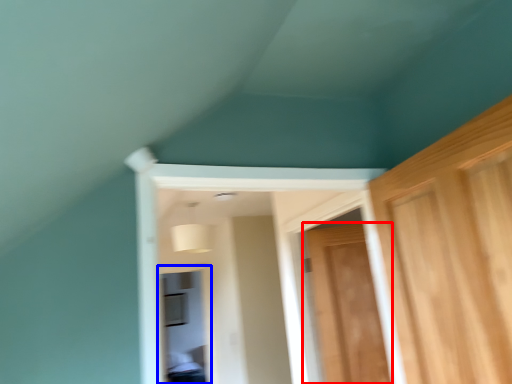
Question: Which object is closer to the camera taking this photo, door (highlighted by a red box) or window (highlighted by a blue box)?

Choices:
 (A) door
 (B) window

Answer: (A)